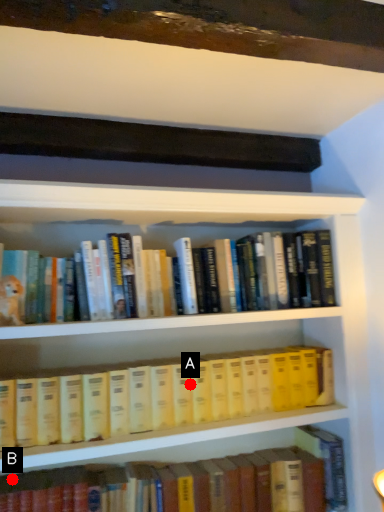
Question: Two points are circled on the image, labeled by A and B beside each circle. Among these points, which one is farthest from the camera?

Choices:
 (A) A is further
 (B) B is further

Answer: (A)